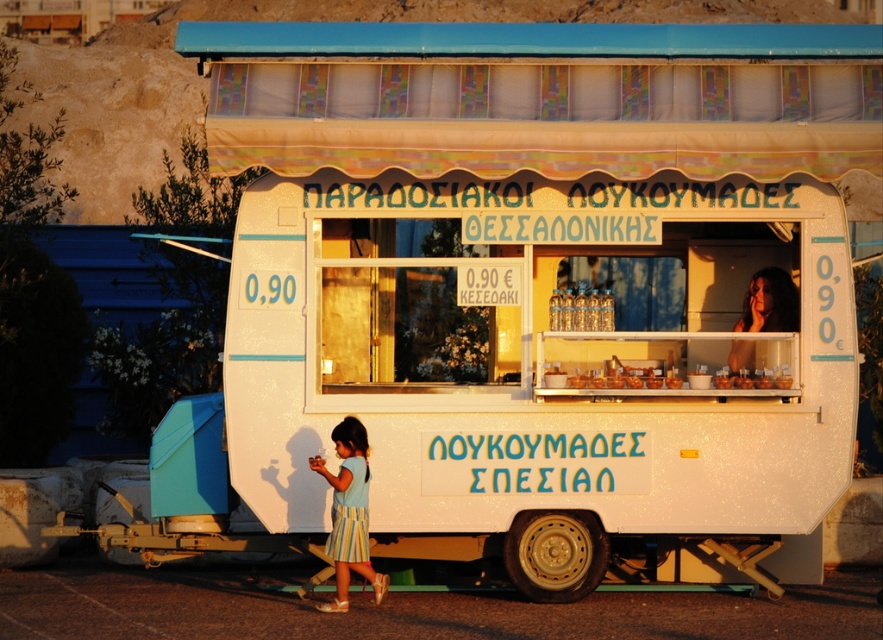
Question: Which of the following is the closest to the observer?

Choices:
 (A) smooth brown hair at upper right
 (B) translucent glass jars at center

Answer: (B)

Question: Which point appears farthest from the camera in this image?

Choices:
 (A) (615, 380)
 (B) (781, 301)
 (C) (361, 490)

Answer: (B)

Question: Which point is closer to the camera taking this photo?

Choices:
 (A) 593,372
 (B) 365,472

Answer: (B)

Question: Can you confirm if light blue fabric dress at lower center is wider than translucent glass jars at center?

Choices:
 (A) no
 (B) yes

Answer: (A)

Question: Can you confirm if light blue fabric dress at lower center is positioned below translucent glass jars at center?

Choices:
 (A) yes
 (B) no

Answer: (A)

Question: Can you confirm if light blue fabric dress at lower center is positioned to the right of smooth brown hair at upper right?

Choices:
 (A) no
 (B) yes

Answer: (A)